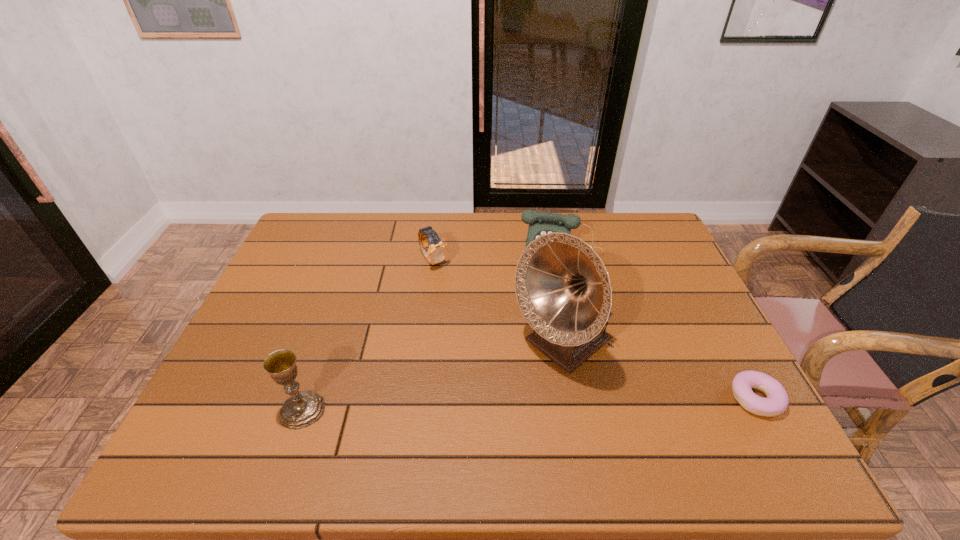
Identify the location of vacant space at the far right corner of the desktop. (636, 213).

Locate an element on the screen. This screenshot has height=540, width=960. empty space that is in between the fourth shortest object and the rightmost object is located at coordinates (529, 404).

Locate an element on the screen. This screenshot has height=540, width=960. vacant point located between the third tallest object and the leftmost object is located at coordinates (433, 332).

Locate an element on the screen. free space between the watch and the tallest object is located at coordinates (498, 303).

Locate an element on the screen. This screenshot has width=960, height=540. free space between the leftmost object and the telephone is located at coordinates (433, 332).

Locate an element on the screen. Image resolution: width=960 pixels, height=540 pixels. free spot between the shortest object and the phonograph record is located at coordinates (659, 373).

I want to click on vacant area between the leftmost object and the doughnut, so click(x=529, y=404).

This screenshot has width=960, height=540. Identify the location of vacant space that's between the doughnut and the tallest object. (659, 373).

Locate an element on the screen. The width and height of the screenshot is (960, 540). free space between the shortest object and the telephone is located at coordinates (659, 327).

Point out which object is positioned as the third nearest to the phonograph record. Please provide its 2D coordinates. Your answer should be formatted as a tuple, i.e. [(x, y)], where the tuple contains the x and y coordinates of a point satisfying the conditions above.

[(436, 252)]